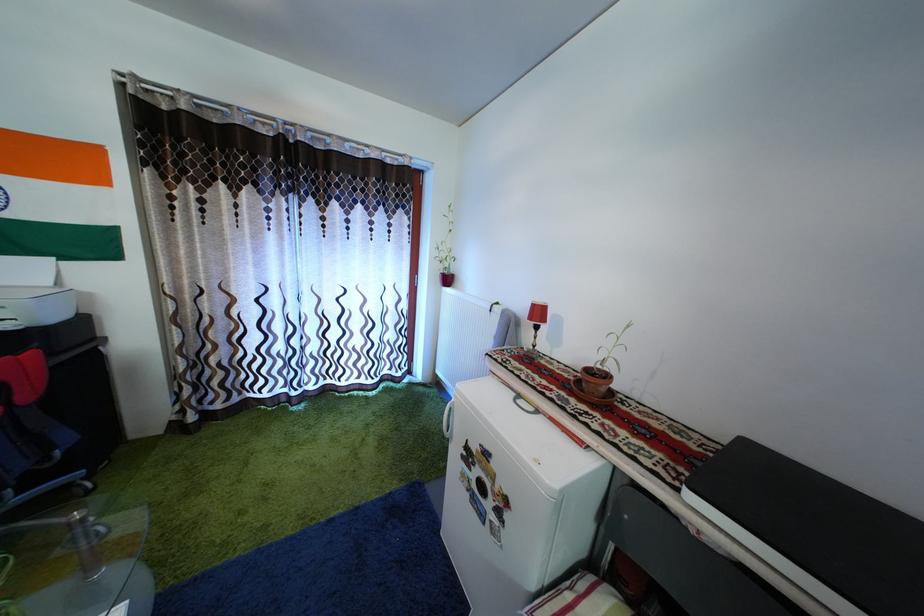
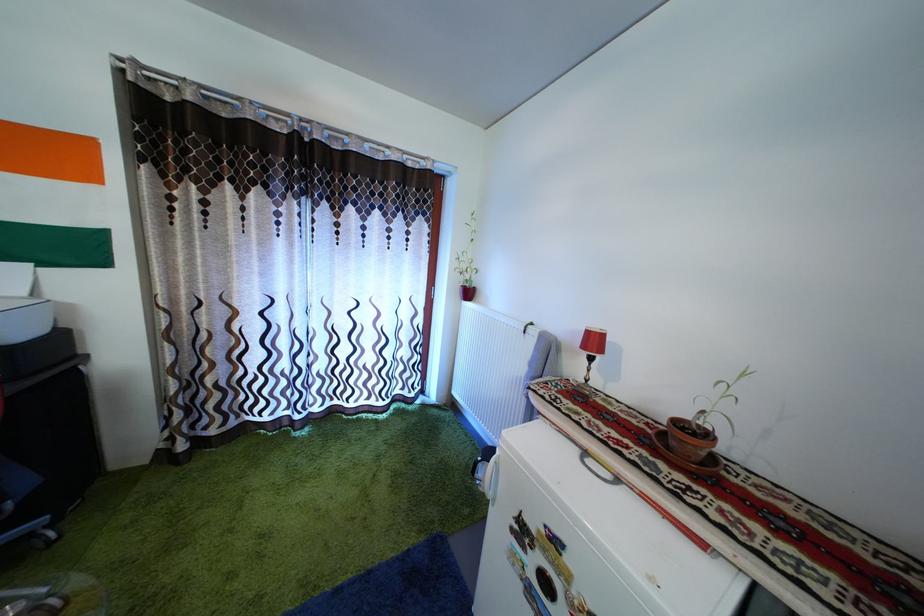
Question: The images are taken continuously from a first-person perspective. In which direction is your viewpoint rotating?

Choices:
 (A) Left
 (B) Right
 (C) Up
 (D) Down

Answer: (C)